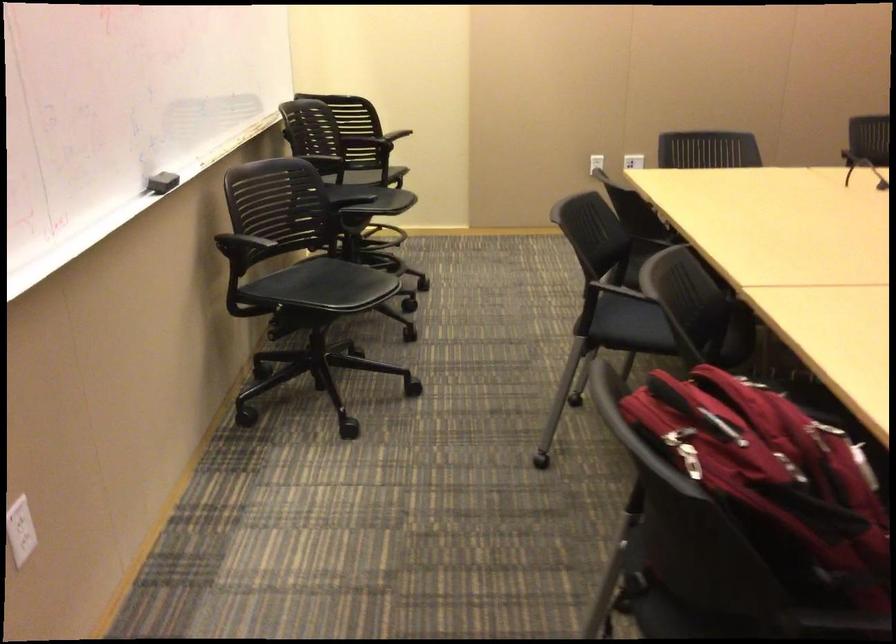
Find where to lift the red backpack. Please return your answer as a coordinate pair (x, y).

(773, 480)